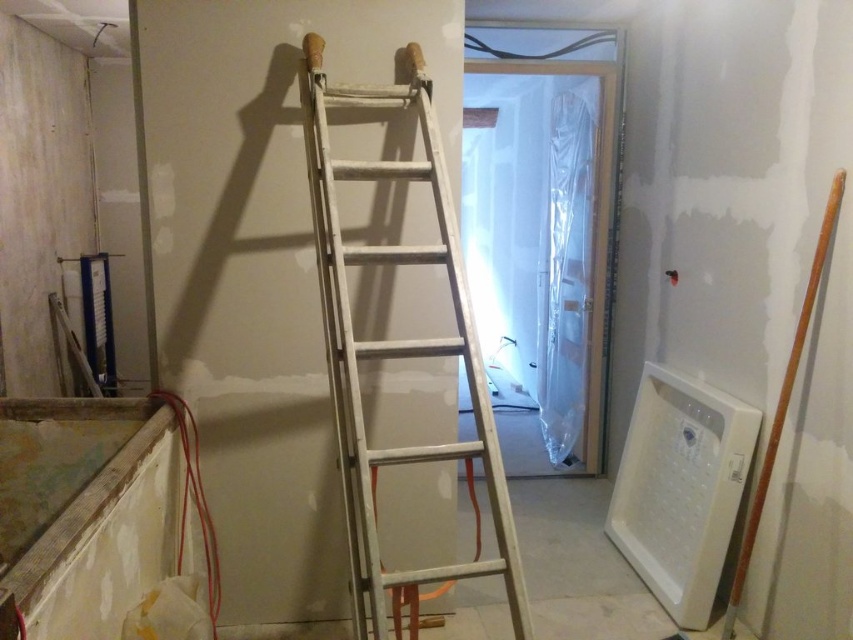
You are a painter needing to reach a high ceiling in the room. You see the white wooden ladder at center and the metallic silver ladder at upper center. Which ladder should you use to reach the ceiling without moving either ladder?

The metallic silver ladder at upper center is positioned higher than the white wooden ladder at center, so you should use the metallic silver ladder at upper center to reach the ceiling without moving either ladder.

You are a painter working in the room and need to reach the ceiling near the doorway. Which ladder should you use, the white wooden ladder at center or the metallic silver ladder at upper center?

You should use the metallic silver ladder at upper center because it is positioned higher, as it is above the white wooden ladder at center, allowing better access to the ceiling near the doorway.